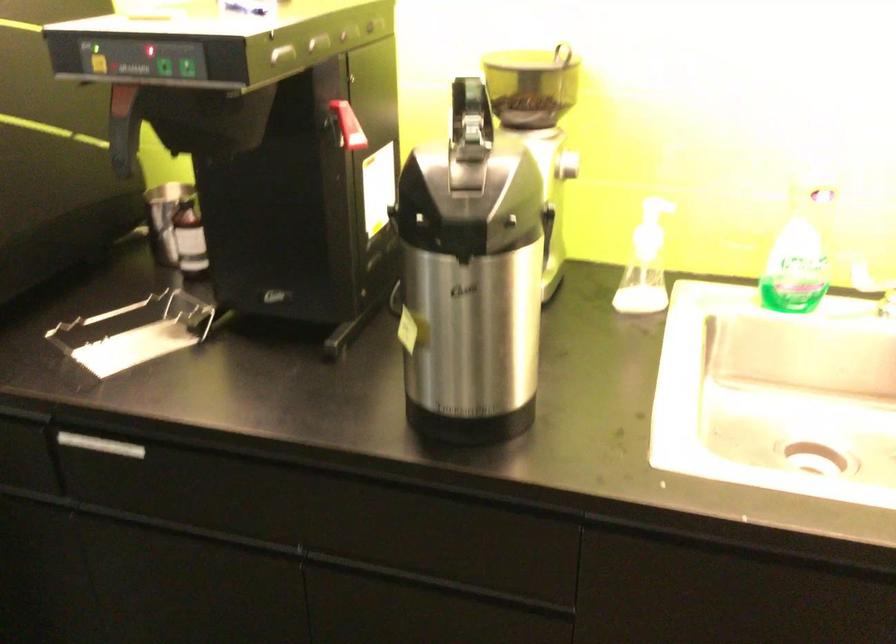
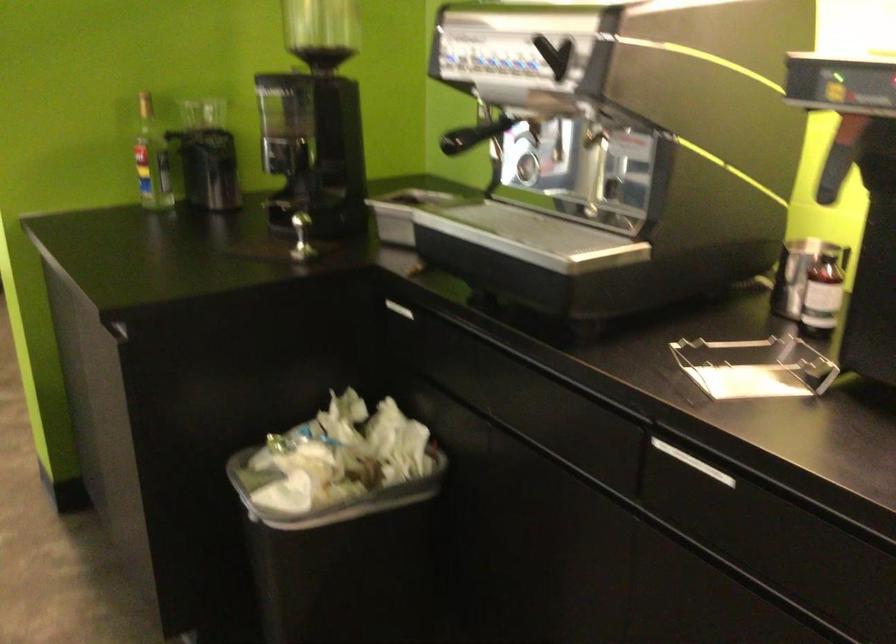
Where in the second image is the point corresponding to point (108, 442) from the first image?

(693, 462)